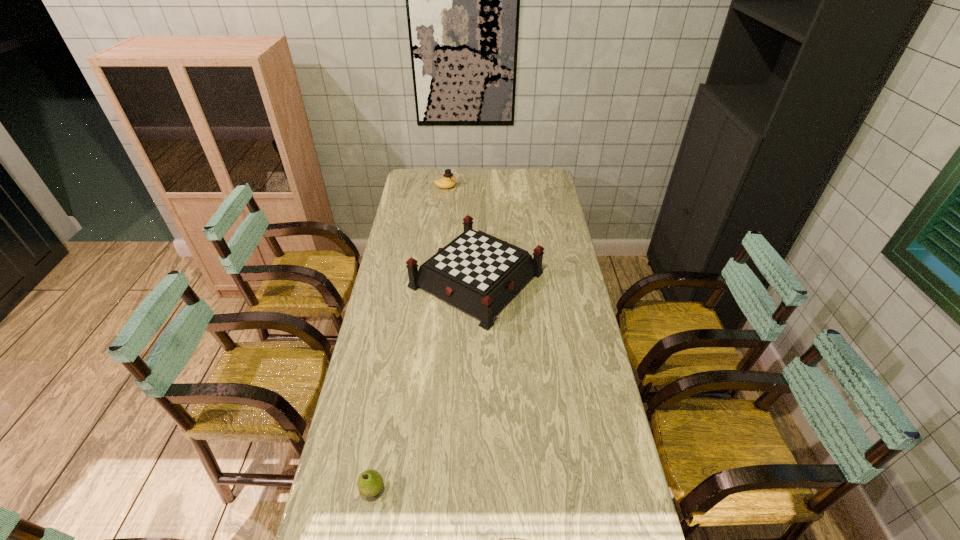
At what (x,y) coordinates should I click in order to perform the action: click on the second nearest object. Please return your answer as a coordinate pair (x, y). Looking at the image, I should click on (478, 273).

The width and height of the screenshot is (960, 540). I want to click on the tallest object, so click(x=478, y=273).

This screenshot has height=540, width=960. Find the location of `the farthest object`. the farthest object is located at coordinates (448, 181).

This screenshot has width=960, height=540. Identify the location of pear. (370, 482).

Locate an element on the screen. This screenshot has height=540, width=960. vacant space located 0.060m on the left of the checkerboard is located at coordinates point(394,279).

Locate an element on the screen. This screenshot has width=960, height=540. vacant region located on the front-facing side of the farthest object is located at coordinates (516, 187).

Locate an element on the screen. vacant area situated 0.380m on the right of the pear is located at coordinates (526, 488).

Locate an element on the screen. object that is at the far edge is located at coordinates (448, 181).

Where is `checkerboard located in the left edge section of the desktop`? This screenshot has width=960, height=540. checkerboard located in the left edge section of the desktop is located at coordinates (478, 273).

You are a GUI agent. You are given a task and a screenshot of the screen. Output one action in this format:
    pyautogui.click(x=<x>, y=<y>)
    Task: Click on the duck that is at the left edge
    The image size is (960, 540).
    Given the screenshot: What is the action you would take?
    pyautogui.click(x=448, y=181)